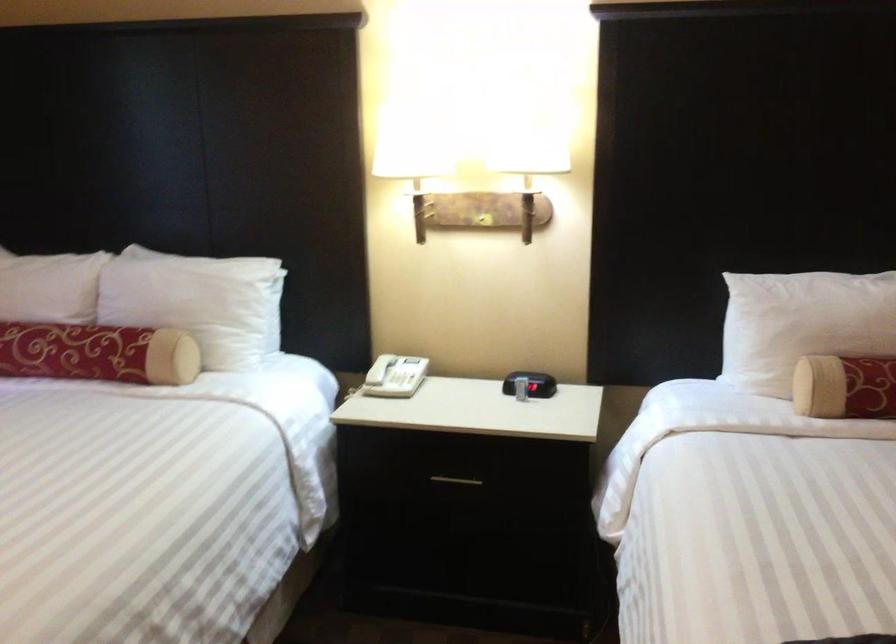
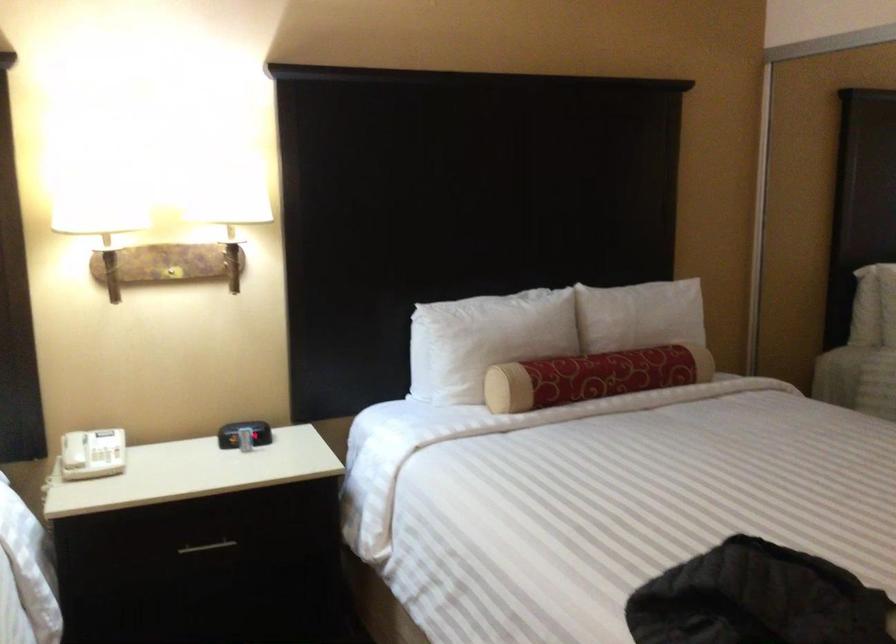
Question: Based on the continuous images, in which direction is the camera rotating? Reply with the corresponding letter.

Choices:
 (A) Left
 (B) Right
 (C) Up
 (D) Down

Answer: (B)